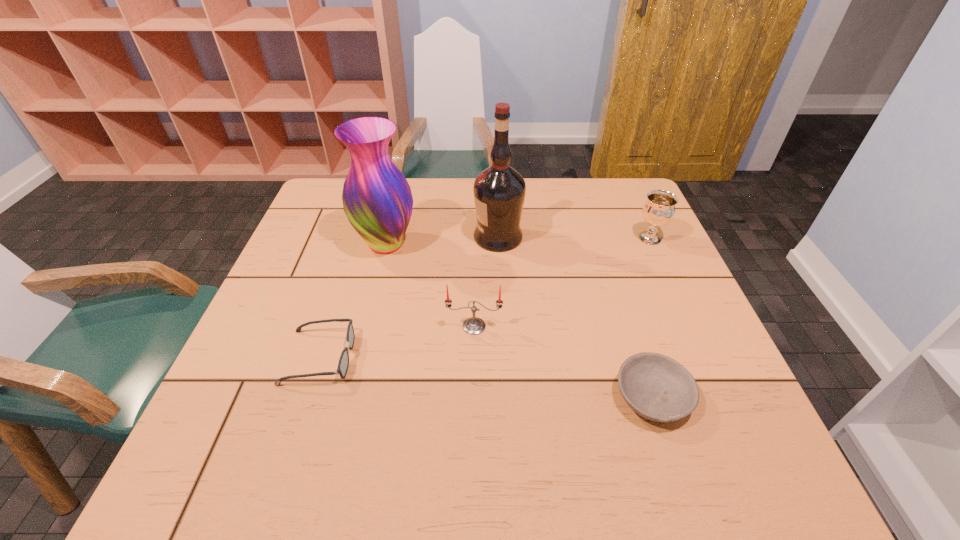
Image resolution: width=960 pixels, height=540 pixels. Find the location of `liquor`. liquor is located at coordinates (499, 191).

Identify the location of vase. (377, 199).

You are a GUI agent. You are given a task and a screenshot of the screen. Output one action in this format:
    pyautogui.click(x=<x>, y=<y>)
    Task: Click on the chalice
    Image resolution: width=960 pixels, height=540 pixels.
    Given the screenshot: What is the action you would take?
    pyautogui.click(x=659, y=209)

You are a GUI agent. You are given a task and a screenshot of the screen. Output one action in this format:
    pyautogui.click(x=<x>, y=<y>)
    Task: Click on the candle
    
    Given the screenshot: What is the action you would take?
    pyautogui.click(x=473, y=325)

Identify the location of spectacles. (343, 364).

Find the location of a particular element. This screenshot has height=540, width=960. bowl is located at coordinates (657, 387).

This screenshot has width=960, height=540. In order to click on vacant space situated 0.150m on the surface of the liquor in this screenshot , I will do `click(420, 237)`.

The width and height of the screenshot is (960, 540). Find the location of `free spot located on the surface of the liquor`. free spot located on the surface of the liquor is located at coordinates click(360, 237).

The width and height of the screenshot is (960, 540). In order to click on vacant space positioned on the surface of the liquor in this screenshot , I will do `click(343, 237)`.

The height and width of the screenshot is (540, 960). Identify the location of vacant region located on the left of the vase. (300, 244).